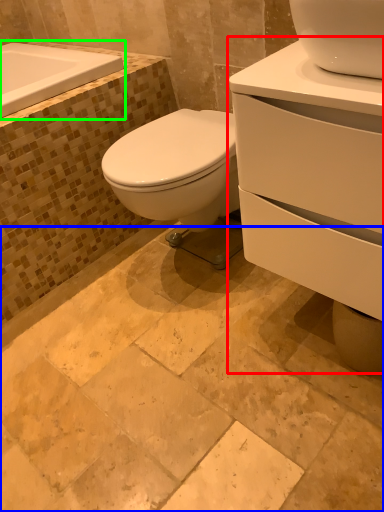
Question: Based on their relative distances, which object is farther from porcelain (highlighted by a red box)? Choose from ceramic tile (highlighted by a blue box) and bath (highlighted by a green box).

Choices:
 (A) ceramic tile
 (B) bath

Answer: (B)